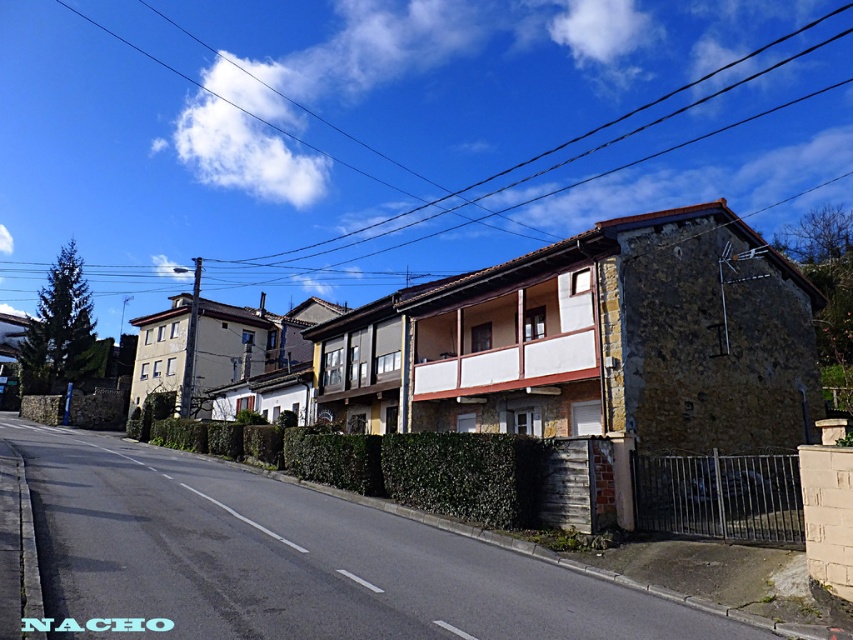
Where is `brown wooden power line at upper center`? The height and width of the screenshot is (640, 853). brown wooden power line at upper center is located at coordinates (393, 132).

Can you confirm if brown wooden power line at upper center is positioned above green leafy hedge at center?

Yes.

Who is more forward, (518,35) or (265,442)?

Point (265,442) is more forward.

I want to click on brown wooden power line at upper center, so click(x=393, y=132).